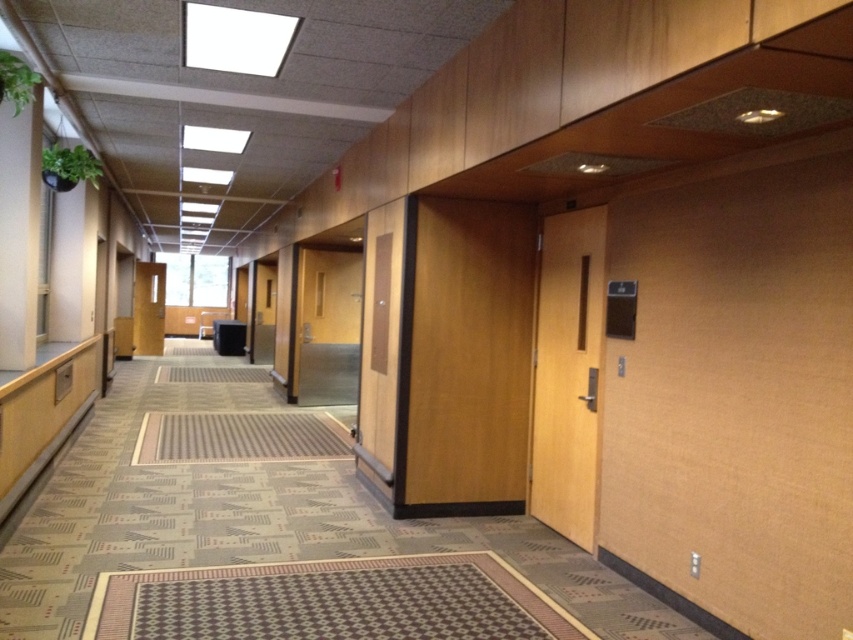
Question: Which of the following is the closest to the observer?

Choices:
 (A) (584, 349)
 (B) (480, 474)

Answer: (A)

Question: Is wooden door at center to the left of light brown wood door at center-right from the viewer's perspective?

Choices:
 (A) yes
 (B) no

Answer: (A)

Question: In this image, where is wooden door at center located relative to light brown wood door at center-right?

Choices:
 (A) right
 (B) left

Answer: (B)

Question: Does wooden door at center appear on the right side of light brown wood door at center-right?

Choices:
 (A) yes
 (B) no

Answer: (B)

Question: Which of the following is the farthest from the observer?

Choices:
 (A) (521, 419)
 (B) (601, 323)

Answer: (A)